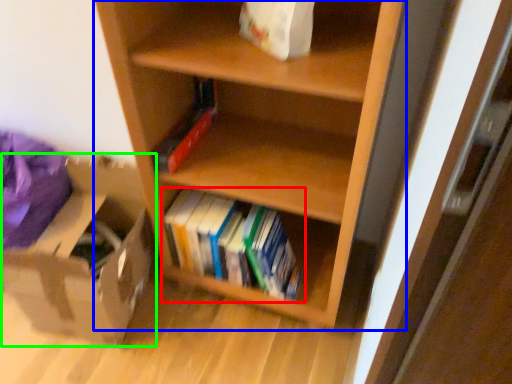
Question: Which object is the closest to the book (highlighted by a red box)? Choose among these: shelf (highlighted by a blue box) or cardboard box (highlighted by a green box).

Choices:
 (A) shelf
 (B) cardboard box

Answer: (A)